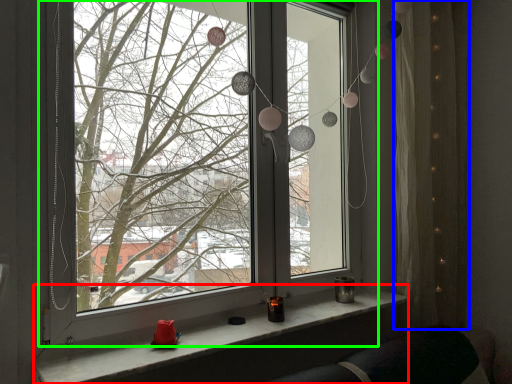
Question: Which object is positioned farthest from window sill (highlighted by a red box)? Select from curtain (highlighted by a blue box) and window (highlighted by a green box).

Choices:
 (A) curtain
 (B) window

Answer: (B)